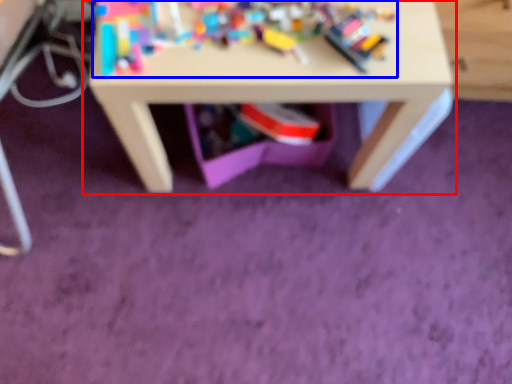
Question: Among these objects, which one is farthest to the camera, table (highlighted by a red box) or toy (highlighted by a blue box)?

Choices:
 (A) table
 (B) toy

Answer: (A)